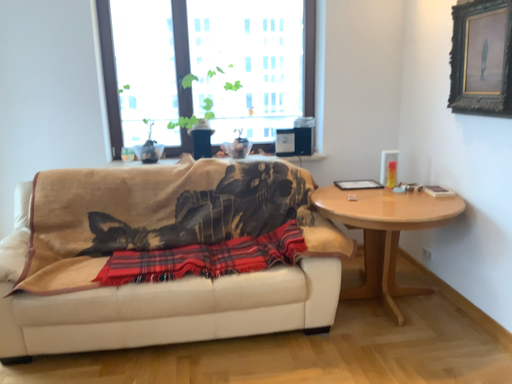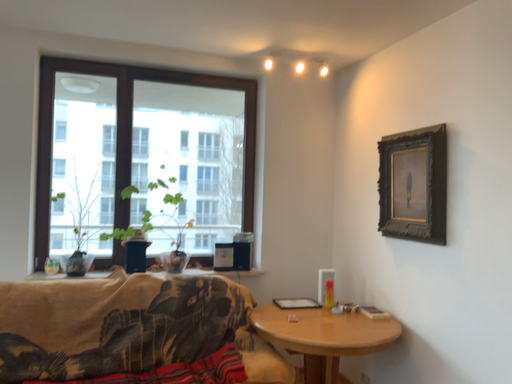
Question: How did the camera likely rotate when shooting the video?

Choices:
 (A) rotated left
 (B) rotated right

Answer: (B)